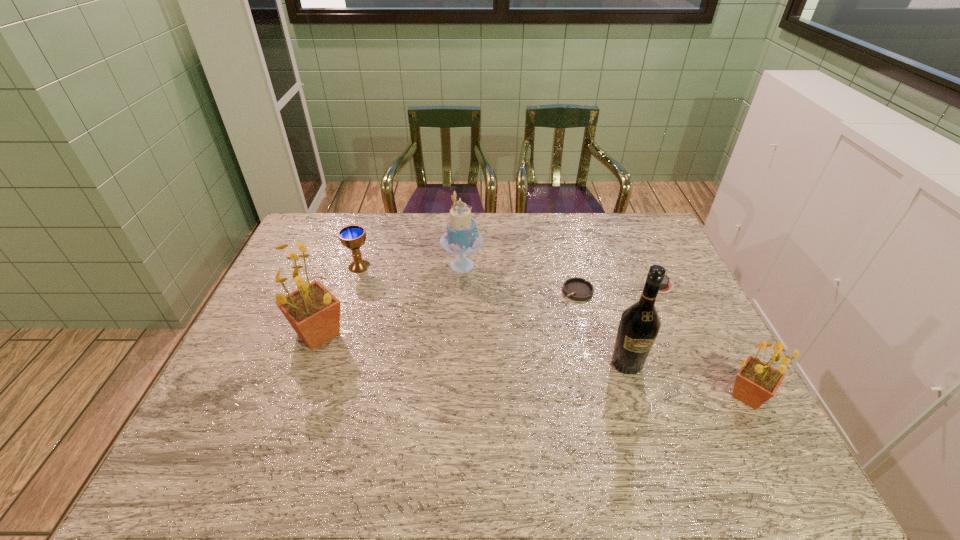
Locate an element on the screen. object located in the near right corner section of the desktop is located at coordinates (756, 382).

This screenshot has height=540, width=960. In the image, there is a desktop. Find the location of `free space at the far edge`. free space at the far edge is located at coordinates (517, 234).

Locate an element on the screen. Image resolution: width=960 pixels, height=540 pixels. free region at the near edge of the desktop is located at coordinates (588, 419).

Locate an element on the screen. This screenshot has width=960, height=540. vacant space at the left edge of the desktop is located at coordinates (241, 359).

Identify the location of blank area at the right edge. The height and width of the screenshot is (540, 960). (x=694, y=320).

In the image, there is a desktop. Where is `free space at the far left corner`? free space at the far left corner is located at coordinates (298, 251).

The height and width of the screenshot is (540, 960). I want to click on vacant space that's between the fourth shortest object and the wine bottle, so click(687, 380).

This screenshot has width=960, height=540. I want to click on free space between the chocolate cake and the taller sunflower, so click(489, 309).

Where is `unoccupied area between the ashtray and the right sunflower`? unoccupied area between the ashtray and the right sunflower is located at coordinates (662, 343).

Identify the location of empty space between the cake and the fourth tallest object. The width and height of the screenshot is (960, 540). (605, 330).